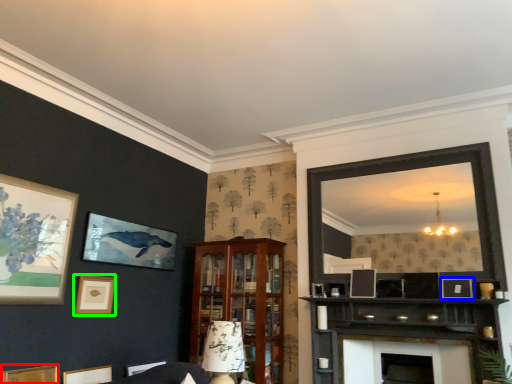
Question: Estimate the real-world distances between objects in this image. Which object is farther from picture frame (highlighted by a red box), picture frame (highlighted by a blue box) or picture frame (highlighted by a green box)?

Choices:
 (A) picture frame
 (B) picture frame

Answer: (A)